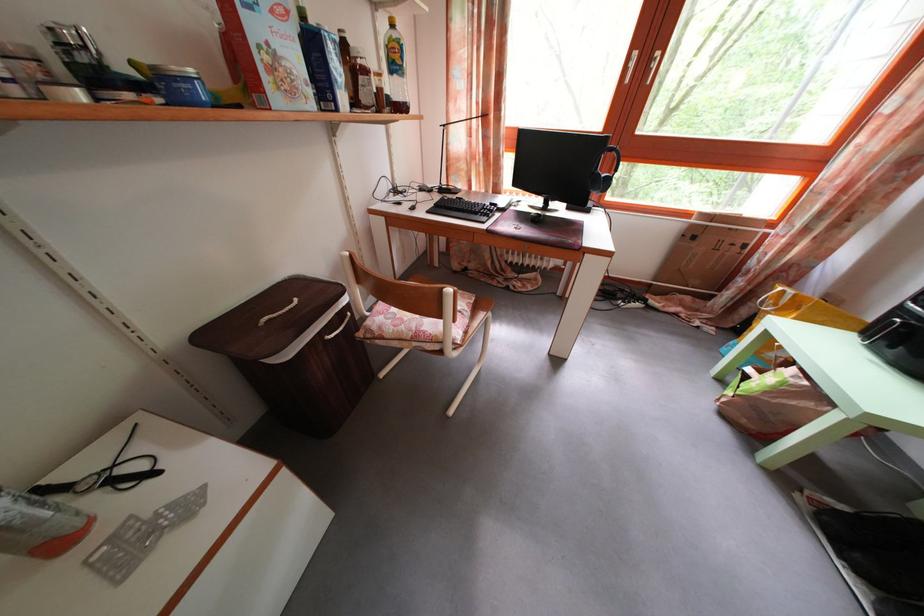
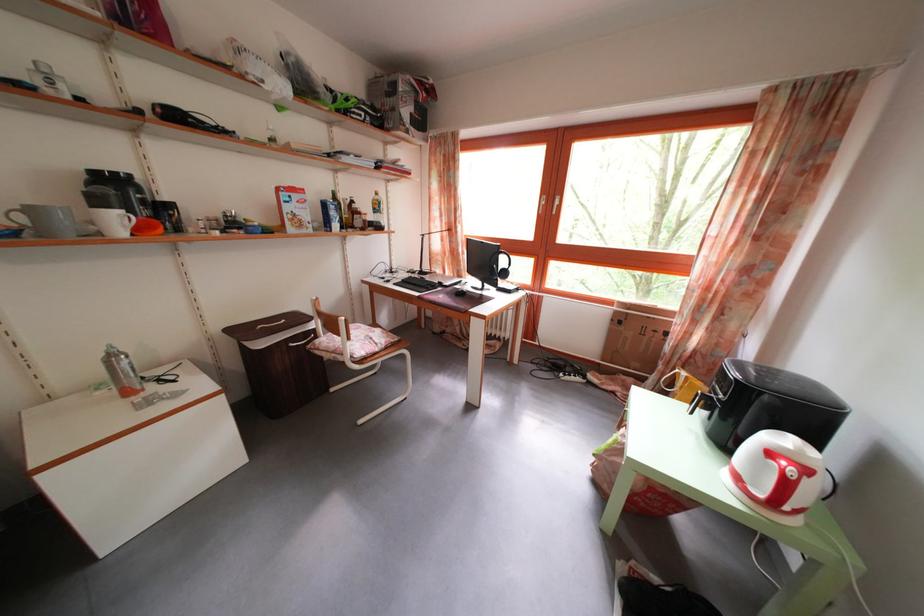
In the second image, find the point that corresponds to the point at 799,299 in the first image.

(691, 381)